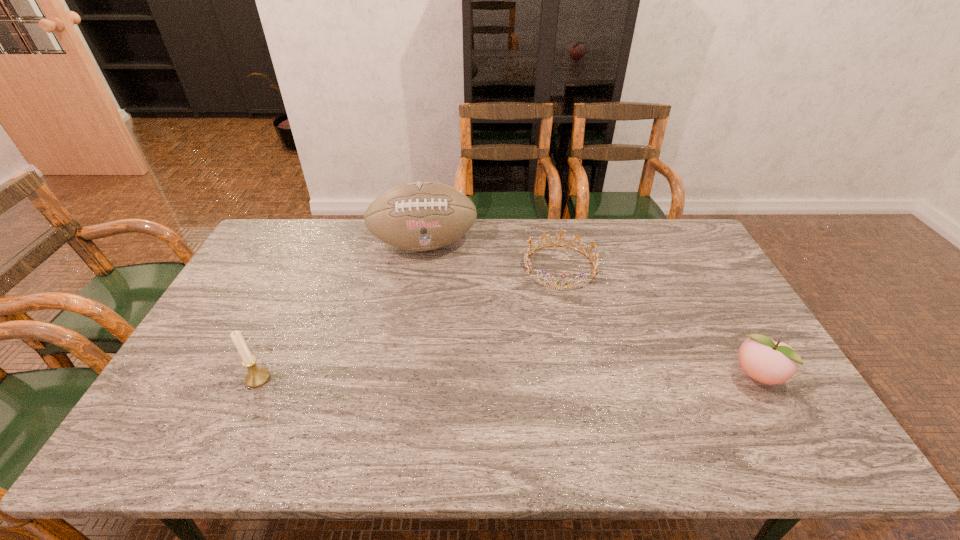
Identify the location of free space between the peach and the football (American). The height and width of the screenshot is (540, 960). (590, 310).

Where is `free space between the third shortest object and the rightmost object`? free space between the third shortest object and the rightmost object is located at coordinates (508, 377).

Image resolution: width=960 pixels, height=540 pixels. I want to click on free spot between the leftmost object and the rightmost object, so click(508, 377).

In order to click on vacant area that lies between the candle holder and the tallest object in this screenshot , I will do `click(341, 311)`.

Where is `free space between the rightmost object and the tallest object`? free space between the rightmost object and the tallest object is located at coordinates (590, 310).

The image size is (960, 540). I want to click on blank region between the tiara and the leftmost object, so click(409, 322).

Image resolution: width=960 pixels, height=540 pixels. Identify the location of free space between the football (American) and the leftmost object. (341, 311).

Find the location of `empty location between the second object from right to left and the second shortest object`. empty location between the second object from right to left and the second shortest object is located at coordinates (659, 322).

Locate an element on the screen. This screenshot has width=960, height=540. object identified as the third closest to the shortest object is located at coordinates (257, 376).

Choose which object is the second nearest neighbor to the leftmost object. Please provide its 2D coordinates. Your answer should be formatted as a tuple, i.e. [(x, y)], where the tuple contains the x and y coordinates of a point satisfying the conditions above.

[(527, 261)]